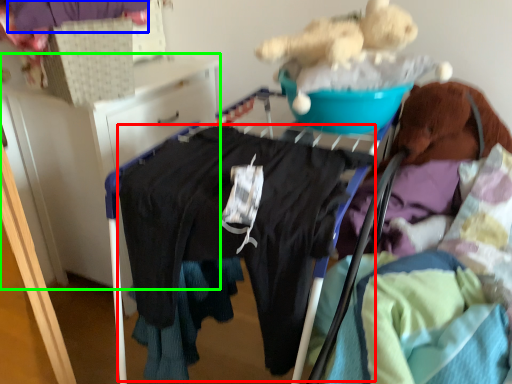
Question: Considering the real-world distances, which object is farthest from clothing (highlighted by a red box)? clothing (highlighted by a blue box) or furniture (highlighted by a green box)?

Choices:
 (A) clothing
 (B) furniture

Answer: (A)